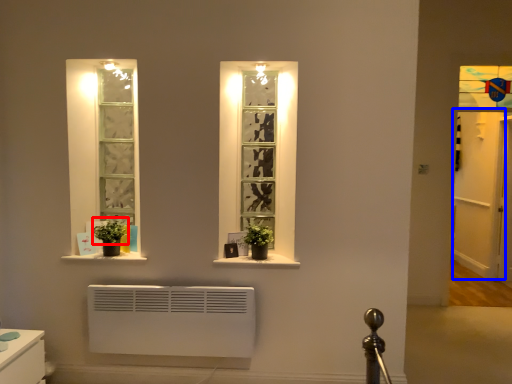
Question: Which object is closer to the camera taking this photo, plant (highlighted by a red box) or glass door (highlighted by a blue box)?

Choices:
 (A) plant
 (B) glass door

Answer: (A)